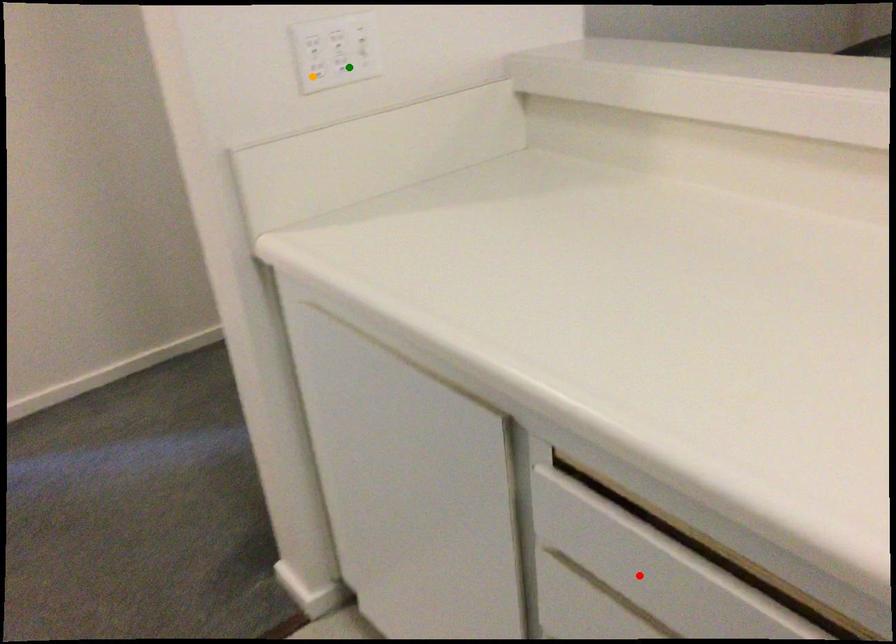
Order these from nearest to farthest:
orange point | green point | red point

green point < orange point < red point